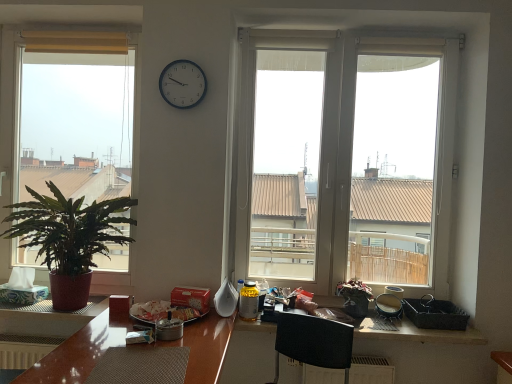
Question: Is white plastic window at center, the second window when ordered from left to right, facing away from black plastic picnic basket at lower right?

Choices:
 (A) yes
 (B) no

Answer: (B)

Question: Is white plastic window at center, the second window when ordered from left to right, wider than black plastic picnic basket at lower right?

Choices:
 (A) yes
 (B) no

Answer: (B)

Question: Is white plastic window at center, positioned as the 1th window in right-to-left order, taller than black plastic picnic basket at lower right?

Choices:
 (A) yes
 (B) no

Answer: (A)

Question: Is white plastic window at center, the second window when ordered from left to right, not within black plastic picnic basket at lower right?

Choices:
 (A) yes
 (B) no

Answer: (A)

Question: Can black plastic picnic basket at lower right be found inside white plastic window at center, positioned as the 1th window in right-to-left order?

Choices:
 (A) no
 (B) yes

Answer: (A)

Question: In the image, is metallic clock at upper center positioned in front of or behind white matte tissue at left?

Choices:
 (A) front
 (B) behind

Answer: (A)

Question: Considering the positions of metallic clock at upper center and white matte tissue at left in the image, is metallic clock at upper center taller or shorter than white matte tissue at left?

Choices:
 (A) tall
 (B) short

Answer: (A)

Question: Is point (187, 107) positioned closer to the camera than point (17, 284)?

Choices:
 (A) farther
 (B) closer

Answer: (B)

Question: Based on their sizes in the image, would you say metallic clock at upper center is bigger or smaller than white matte tissue at left?

Choices:
 (A) small
 (B) big

Answer: (A)

Question: In terms of height, does wooden textured counter top at lower center look taller or shorter compared to metallic clock at upper center?

Choices:
 (A) tall
 (B) short

Answer: (B)

Question: Is wooden textured counter top at lower center wider or thinner than metallic clock at upper center?

Choices:
 (A) thin
 (B) wide

Answer: (B)

Question: Is wooden textured counter top at lower center inside or outside of metallic clock at upper center?

Choices:
 (A) inside
 (B) outside

Answer: (B)

Question: Is wooden textured counter top at lower center to the left or to the right of metallic clock at upper center in the image?

Choices:
 (A) right
 (B) left

Answer: (A)

Question: Based on their sizes in the image, would you say green matte plant at left, which appears as the 1th window when viewed from the left, is bigger or smaller than metallic clock at upper center?

Choices:
 (A) small
 (B) big

Answer: (B)

Question: Is green matte plant at left, acting as the 2th window starting from the right, wider or thinner than metallic clock at upper center?

Choices:
 (A) thin
 (B) wide

Answer: (B)